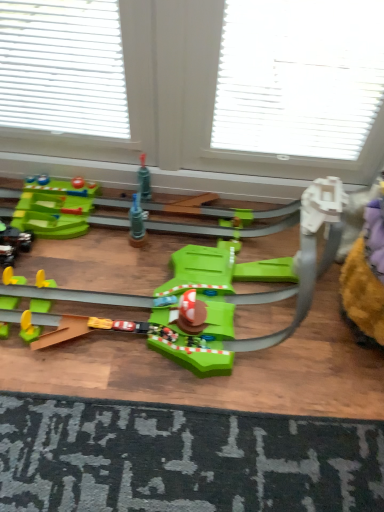
Question: Is dark gray textured doormat at bottom wider than shiny black car at left, acting as the 1th toy starting from the left?

Choices:
 (A) yes
 (B) no

Answer: (A)

Question: Would you say dark gray textured doormat at bottom is outside shiny black car at left, the first toy positioned from the back?

Choices:
 (A) no
 (B) yes

Answer: (B)

Question: Is dark gray textured doormat at bottom positioned behind shiny black car at left, which is counted as the second toy, starting from the front?

Choices:
 (A) yes
 (B) no

Answer: (B)

Question: Is dark gray textured doormat at bottom positioned far away from shiny black car at left, the first toy in the bottom-to-top sequence?

Choices:
 (A) no
 (B) yes

Answer: (A)

Question: Is dark gray textured doormat at bottom taller than shiny black car at left, acting as the 1th toy starting from the left?

Choices:
 (A) no
 (B) yes

Answer: (A)

Question: Is dark gray textured doormat at bottom at the left side of shiny black car at left, the first toy positioned from the back?

Choices:
 (A) yes
 (B) no

Answer: (B)

Question: Is shiny black car at left, arranged as the 2th toy when viewed from the top, at the left side of green plastic toy at center, arranged as the 1th toy when viewed from the front?

Choices:
 (A) no
 (B) yes

Answer: (B)

Question: Is shiny black car at left, acting as the 1th toy starting from the left, taller than green plastic toy at center, positioned as the 1th toy in top-to-bottom order?

Choices:
 (A) yes
 (B) no

Answer: (B)

Question: Considering the relative sizes of shiny black car at left, which is counted as the second toy, starting from the front, and green plastic toy at center, placed as the second toy when sorted from bottom to top, in the image provided, is shiny black car at left, which is counted as the second toy, starting from the front, thinner than green plastic toy at center, placed as the second toy when sorted from bottom to top,?

Choices:
 (A) no
 (B) yes

Answer: (B)

Question: Is shiny black car at left, acting as the 1th toy starting from the left, smaller than green plastic toy at center, the 1th toy from the right?

Choices:
 (A) yes
 (B) no

Answer: (A)

Question: Could you tell me if shiny black car at left, arranged as the 2th toy when viewed from the top, is facing green plastic toy at center, arranged as the 1th toy when viewed from the front?

Choices:
 (A) no
 (B) yes

Answer: (B)

Question: Could green plastic toy at center, the 2th toy in the back-to-front sequence, be considered to be inside shiny black car at left, arranged as the 2th toy when viewed from the top?

Choices:
 (A) no
 (B) yes

Answer: (A)

Question: From a real-world perspective, is green plastic toy at center, positioned as the 1th toy in top-to-bottom order, below shiny black car at left, which is counted as the second toy, starting from the front?

Choices:
 (A) no
 (B) yes

Answer: (A)